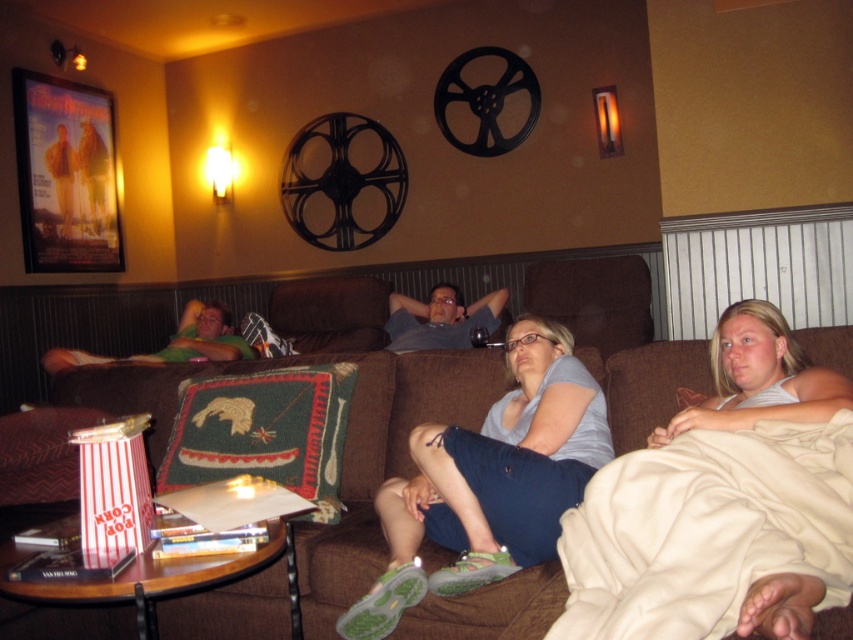
Is point (724, 584) positioned before point (61, 349)?

Yes, it is.

Which of these two, beige fleece blanket at lower right or green fabric couch at left, stands taller?

green fabric couch at left

Where is `beige fleece blanket at lower right`? The image size is (853, 640). beige fleece blanket at lower right is located at coordinates (706, 529).

Identify the location of beige fleece blanket at lower right. (706, 529).

Can you confirm if matte gray shirt at center is positioned below green fabric couch at left?

No, matte gray shirt at center is not below green fabric couch at left.

Describe the element at coordinates (440, 317) in the screenshot. I see `matte gray shirt at center` at that location.

Does point (393, 330) lie in front of point (54, 349)?

That is False.

Image resolution: width=853 pixels, height=640 pixels. I want to click on matte gray shirt at center, so click(440, 317).

Can you confirm if blue denim shorts at center is positioned below blonde hair at center?

Yes.

Is blue denim shorts at center smaller than blonde hair at center?

No.

Describe the element at coordinates (490, 481) in the screenshot. I see `blue denim shorts at center` at that location.

This screenshot has width=853, height=640. I want to click on blue denim shorts at center, so click(x=490, y=481).